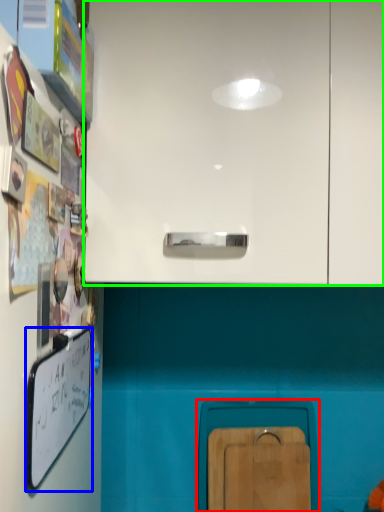
Question: Based on their relative distances, which object is farther from cabinetry (highlighted by a red box)? Choose from whiteboard (highlighted by a blue box) and cabinetry (highlighted by a green box).

Choices:
 (A) whiteboard
 (B) cabinetry

Answer: (B)